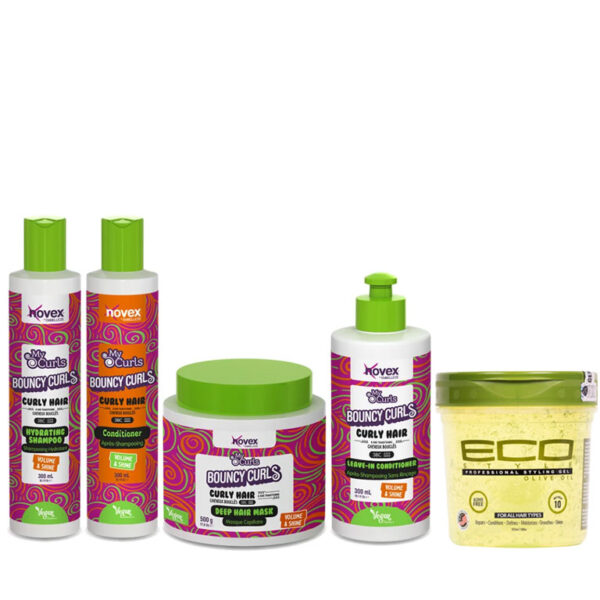
The width and height of the screenshot is (600, 600). Find the location of `bottle/jars`. bottle/jars is located at coordinates (45, 332), (122, 329), (184, 447), (341, 426), (490, 421).